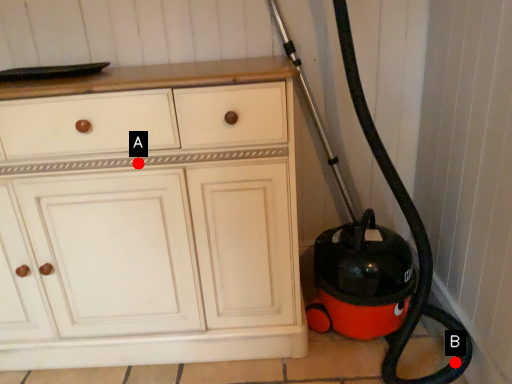
Question: Two points are circled on the image, labeled by A and B beside each circle. Which point is closer to the camera?

Choices:
 (A) A is closer
 (B) B is closer

Answer: (A)